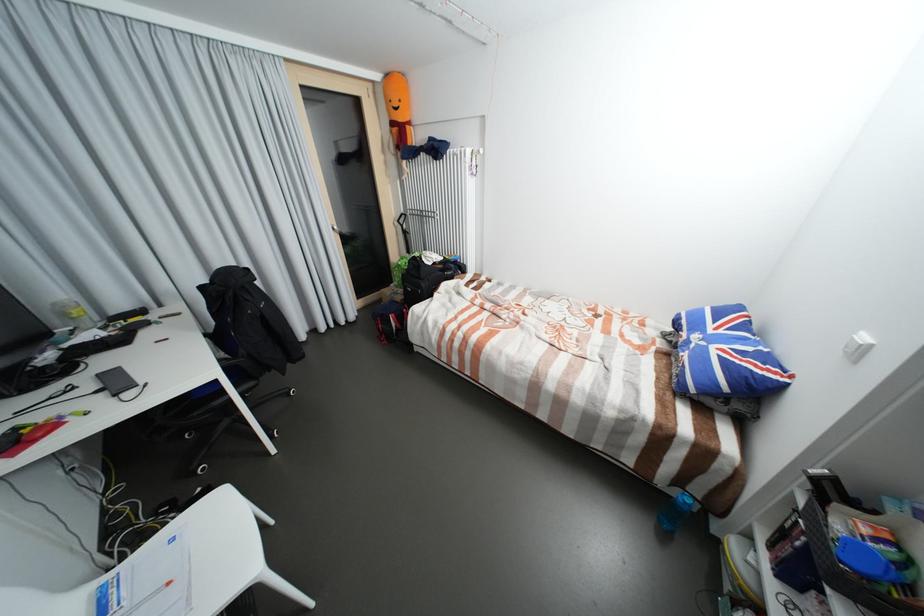
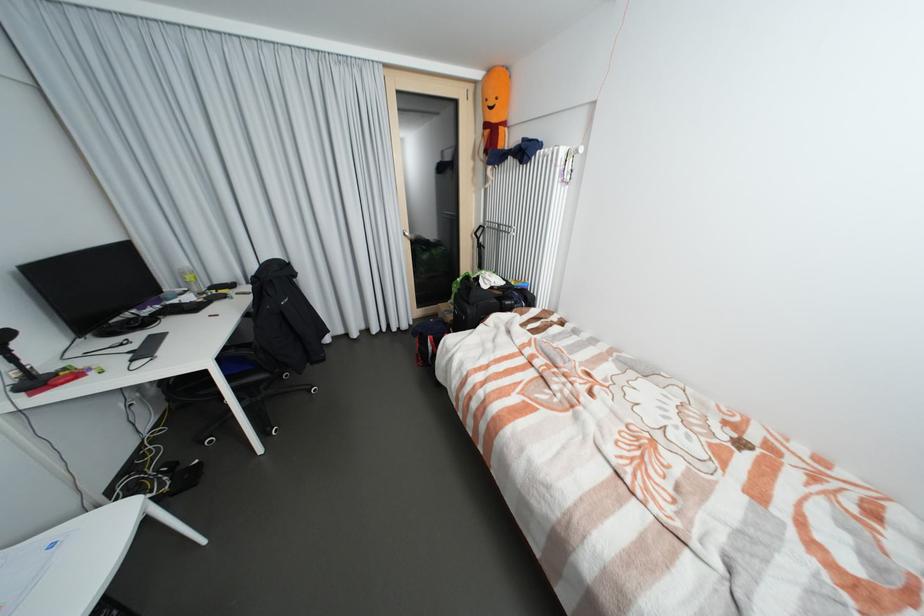
Find the pixel in the second image that matches pixel 353 240 in the first image.

(426, 246)